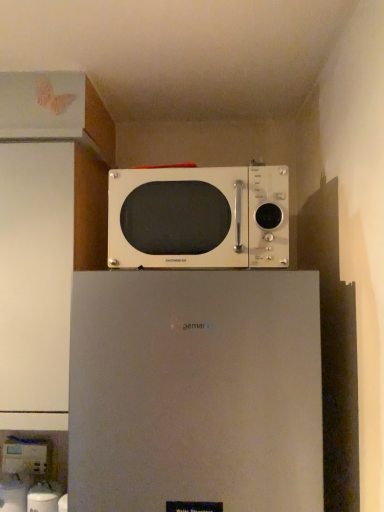
What do you see at coordinates (198, 218) in the screenshot? This screenshot has width=384, height=512. I see `white glossy microwave at upper center` at bounding box center [198, 218].

The image size is (384, 512). I want to click on white plastic water dispenser at lower left, which appears as the first appliance when viewed from the top, so click(26, 456).

Is white glossy microwave at upper center with white glossy water dispenser at lower left, the 1th appliance positioned from the front?

white glossy microwave at upper center is not next to white glossy water dispenser at lower left, the 1th appliance positioned from the front, and they're not touching.

Does white glossy microwave at upper center have a greater height compared to white glossy water dispenser at lower left, acting as the 1th appliance starting from the right?

Yes.

Would you say white glossy microwave at upper center contains white glossy water dispenser at lower left, the 1th appliance positioned from the front?

Definitely not — white glossy water dispenser at lower left, the 1th appliance positioned from the front, is not inside white glossy microwave at upper center.

From the image's perspective, starting from the satin white refrigerator at upper center, which appliance is the 2nd one below? Please provide its 2D coordinates.

[(42, 498)]

Does white glossy water dispenser at lower left, which appears as the 2th appliance when viewed from the back, have a lesser width compared to satin white refrigerator at upper center?

Yes.

How different are the orientations of white glossy water dispenser at lower left, acting as the 1th appliance starting from the right, and satin white refrigerator at upper center in degrees?

The angular difference between white glossy water dispenser at lower left, acting as the 1th appliance starting from the right, and satin white refrigerator at upper center is 6.72 degrees.

Considering the relative sizes of white plastic water dispenser at lower left, the second appliance positioned from the front, and white glossy microwave at upper center in the image provided, is white plastic water dispenser at lower left, the second appliance positioned from the front, wider than white glossy microwave at upper center?

Incorrect, the width of white plastic water dispenser at lower left, the second appliance positioned from the front, does not surpass that of white glossy microwave at upper center.

Considering the relative positions of white plastic water dispenser at lower left, arranged as the 2th appliance when ordered from the bottom, and white glossy microwave at upper center in the image provided, is white plastic water dispenser at lower left, arranged as the 2th appliance when ordered from the bottom, to the right of white glossy microwave at upper center from the viewer's perspective?

Incorrect, white plastic water dispenser at lower left, arranged as the 2th appliance when ordered from the bottom, is not on the right side of white glossy microwave at upper center.

Considering the sizes of white plastic water dispenser at lower left, acting as the first appliance starting from the left, and white glossy microwave at upper center in the image, is white plastic water dispenser at lower left, acting as the first appliance starting from the left, taller or shorter than white glossy microwave at upper center?

In the image, white plastic water dispenser at lower left, acting as the first appliance starting from the left, appears to be shorter than white glossy microwave at upper center.

Considering the relative positions of white plastic water dispenser at lower left, marked as the 1th appliance in a back-to-front arrangement, and satin white refrigerator at upper center in the image provided, is white plastic water dispenser at lower left, marked as the 1th appliance in a back-to-front arrangement, to the left of satin white refrigerator at upper center from the viewer's perspective?

Correct, you'll find white plastic water dispenser at lower left, marked as the 1th appliance in a back-to-front arrangement, to the left of satin white refrigerator at upper center.

Is white plastic water dispenser at lower left, arranged as the 2th appliance when ordered from the bottom, not inside satin white refrigerator at upper center?

Indeed, white plastic water dispenser at lower left, arranged as the 2th appliance when ordered from the bottom, is completely outside satin white refrigerator at upper center.

Looking at this image, considering the positions of objects white plastic water dispenser at lower left, the second appliance positioned from the front, and satin white refrigerator at upper center in the image provided, who is behind, white plastic water dispenser at lower left, the second appliance positioned from the front, or satin white refrigerator at upper center?

Positioned behind is white plastic water dispenser at lower left, the second appliance positioned from the front.

Does white glossy microwave at upper center appear on the left side of satin white refrigerator at upper center?

No, white glossy microwave at upper center is not to the left of satin white refrigerator at upper center.

Is white glossy microwave at upper center far from satin white refrigerator at upper center?

No, white glossy microwave at upper center is not far away from satin white refrigerator at upper center.

Does white glossy microwave at upper center have a lesser height compared to satin white refrigerator at upper center?

Correct, white glossy microwave at upper center is not as tall as satin white refrigerator at upper center.

Looking at their sizes, would you say white glossy microwave at upper center is wider or thinner than satin white refrigerator at upper center?

Clearly, white glossy microwave at upper center has less width compared to satin white refrigerator at upper center.

Considering the positions of objects satin white refrigerator at upper center and white glossy water dispenser at lower left, marked as the second appliance in a left-to-right arrangement, in the image provided, who is more to the left, satin white refrigerator at upper center or white glossy water dispenser at lower left, marked as the second appliance in a left-to-right arrangement,?

white glossy water dispenser at lower left, marked as the second appliance in a left-to-right arrangement.

From the image's perspective, is satin white refrigerator at upper center over white glossy water dispenser at lower left, the 1th appliance positioned from the front?

Yes, from the image's perspective, satin white refrigerator at upper center is on top of white glossy water dispenser at lower left, the 1th appliance positioned from the front.

Can you confirm if satin white refrigerator at upper center is thinner than white glossy water dispenser at lower left, the 1th appliance positioned from the front?

No.

Is white glossy water dispenser at lower left, the second appliance in the top-to-bottom sequence, bigger or smaller than white plastic water dispenser at lower left, marked as the 1th appliance in a back-to-front arrangement?

white glossy water dispenser at lower left, the second appliance in the top-to-bottom sequence, is bigger than white plastic water dispenser at lower left, marked as the 1th appliance in a back-to-front arrangement.

Who is more distant, white glossy water dispenser at lower left, which appears as the 2th appliance when viewed from the back, or white plastic water dispenser at lower left, arranged as the 2th appliance when ordered from the bottom?

white plastic water dispenser at lower left, arranged as the 2th appliance when ordered from the bottom, is behind.

Is point (30, 499) closer or farther from the camera than point (30, 473)?

Point (30, 499).

From a real-world perspective, is white glossy water dispenser at lower left, which appears as the 2th appliance when viewed from the back, positioned above or below white plastic water dispenser at lower left, marked as the 1th appliance in a back-to-front arrangement?

white glossy water dispenser at lower left, which appears as the 2th appliance when viewed from the back, is below white plastic water dispenser at lower left, marked as the 1th appliance in a back-to-front arrangement.

Find the location of `microwave oven above the white glossy water dispenser at lower left, the 1th appliance positioned from the front (from a real-world perspective)`. microwave oven above the white glossy water dispenser at lower left, the 1th appliance positioned from the front (from a real-world perspective) is located at coordinates [198, 218].

You are a GUI agent. You are given a task and a screenshot of the screen. Output one action in this format:
    pyautogui.click(x=<x>, y=<y>)
    Task: Click on the refrigerator in front of the white glossy water dispenser at lower left, the second appliance in the top-to-bottom sequence
    
    Given the screenshot: What is the action you would take?
    pyautogui.click(x=195, y=391)

When comparing their distances from white glossy water dispenser at lower left, which appears as the 2th appliance when viewed from the back, does satin white refrigerator at upper center or white plastic water dispenser at lower left, acting as the first appliance starting from the left, seem further?

satin white refrigerator at upper center lies further to white glossy water dispenser at lower left, which appears as the 2th appliance when viewed from the back, than the other object.

From the image, which object appears to be farther from white glossy microwave at upper center, satin white refrigerator at upper center or white plastic water dispenser at lower left, placed as the 2th appliance when sorted from right to left?

white plastic water dispenser at lower left, placed as the 2th appliance when sorted from right to left, is positioned further to the anchor white glossy microwave at upper center.

Considering their positions, is satin white refrigerator at upper center positioned further to white plastic water dispenser at lower left, arranged as the 2th appliance when ordered from the bottom, than white glossy microwave at upper center?

white glossy microwave at upper center.

Considering their positions, is white plastic water dispenser at lower left, placed as the 2th appliance when sorted from right to left, positioned closer to white glossy microwave at upper center than white glossy water dispenser at lower left, acting as the 1th appliance starting from the right?

white glossy water dispenser at lower left, acting as the 1th appliance starting from the right.

Looking at the image, which one is located closer to white glossy water dispenser at lower left, acting as the 1th appliance starting from the right, satin white refrigerator at upper center or white glossy microwave at upper center?

The object closer to white glossy water dispenser at lower left, acting as the 1th appliance starting from the right, is satin white refrigerator at upper center.

When comparing their distances from white glossy water dispenser at lower left, which appears as the 2th appliance when viewed from the back, does white plastic water dispenser at lower left, placed as the 2th appliance when sorted from right to left, or white glossy microwave at upper center seem closer?

white plastic water dispenser at lower left, placed as the 2th appliance when sorted from right to left, is positioned closer to the anchor white glossy water dispenser at lower left, which appears as the 2th appliance when viewed from the back.

Estimate the real-world distances between objects in this image. Which object is further from white glossy water dispenser at lower left, the second appliance in the top-to-bottom sequence, white glossy microwave at upper center or white plastic water dispenser at lower left, which appears as the first appliance when viewed from the top?

Based on the image, white glossy microwave at upper center appears to be further to white glossy water dispenser at lower left, the second appliance in the top-to-bottom sequence.

Which object lies nearer to the anchor point white plastic water dispenser at lower left, which appears as the first appliance when viewed from the top, satin white refrigerator at upper center or white glossy water dispenser at lower left, acting as the 1th appliance starting from the right?

white glossy water dispenser at lower left, acting as the 1th appliance starting from the right, is closer to white plastic water dispenser at lower left, which appears as the first appliance when viewed from the top.

The width and height of the screenshot is (384, 512). I want to click on refrigerator between white glossy microwave at upper center and white plastic water dispenser at lower left, which appears as the first appliance when viewed from the top, in the up-down direction, so click(195, 391).

Locate an element on the screen. This screenshot has height=512, width=384. appliance located between satin white refrigerator at upper center and white plastic water dispenser at lower left, marked as the 1th appliance in a back-to-front arrangement, in the depth direction is located at coordinates (42, 498).

The image size is (384, 512). I want to click on appliance between white glossy microwave at upper center and white glossy water dispenser at lower left, the second appliance in the top-to-bottom sequence, vertically, so click(26, 456).

Locate an element on the screen. This screenshot has height=512, width=384. refrigerator between white glossy microwave at upper center and white glossy water dispenser at lower left, the second appliance in the top-to-bottom sequence, in the vertical direction is located at coordinates (195, 391).